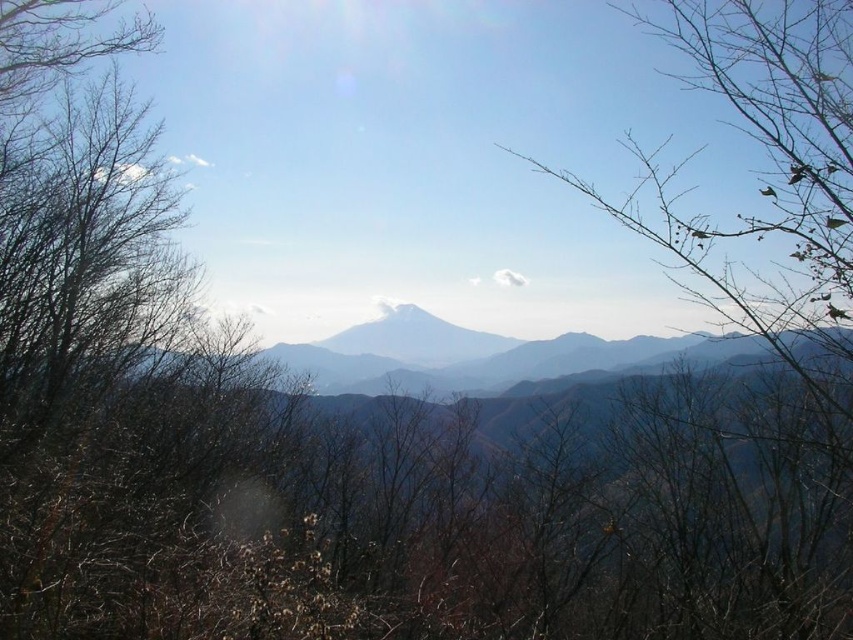
Question: Can you confirm if gray foggy mountain range at center is wider than white snow-capped peak at center?

Choices:
 (A) yes
 (B) no

Answer: (A)

Question: Estimate the real-world distances between objects in this image. Which object is farther from the brown leafless branches at upper right?

Choices:
 (A) gray foggy mountain range at center
 (B) brown/dry branches at left
 (C) white snow-capped peak at center

Answer: (C)

Question: Which point is farther to the camera?

Choices:
 (A) (816, 182)
 (B) (218, 598)
 (C) (489, 384)

Answer: (C)

Question: Which object is farther from the camera taking this photo?

Choices:
 (A) brown/dry branches at left
 (B) gray foggy mountain range at center
 (C) white snow-capped peak at center
 (D) brown leafless branches at upper right

Answer: (C)

Question: Does gray foggy mountain range at center appear on the right side of white snow-capped peak at center?

Choices:
 (A) no
 (B) yes

Answer: (B)

Question: Is brown/dry branches at left to the left of white snow-capped peak at center from the viewer's perspective?

Choices:
 (A) yes
 (B) no

Answer: (A)